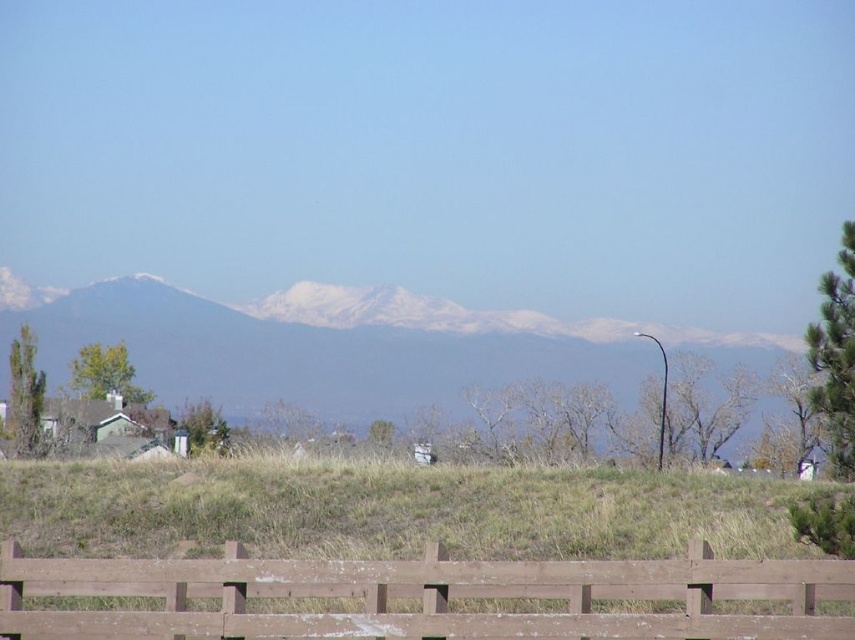
Which of these two, green grassy hill at center or snowy white mountains at center, stands taller?

With more height is snowy white mountains at center.

Is point (226, 460) positioned after point (608, 364)?

No, it is not.

The image size is (855, 640). Identify the location of green grassy hill at center. (388, 509).

Between point (399, 579) and point (670, 360), which one is positioned in front?

Point (399, 579)

Which of these two, brown wooden fence at lower center or snowy white mountains at center, stands taller?

snowy white mountains at center

Between point (378, 636) and point (334, 394), which one is positioned behind?

Positioned behind is point (334, 394).

Where is `brown wooden fence at lower center`? brown wooden fence at lower center is located at coordinates (423, 596).

Who is higher up, green grassy hill at center or brown wooden fence at lower center?

brown wooden fence at lower center is higher up.

Which is behind, point (681, 524) or point (691, 556)?

The point (681, 524) is more distant.

What do you see at coordinates (388, 509) in the screenshot? This screenshot has height=640, width=855. I see `green grassy hill at center` at bounding box center [388, 509].

This screenshot has width=855, height=640. Identify the location of green grassy hill at center. (388, 509).